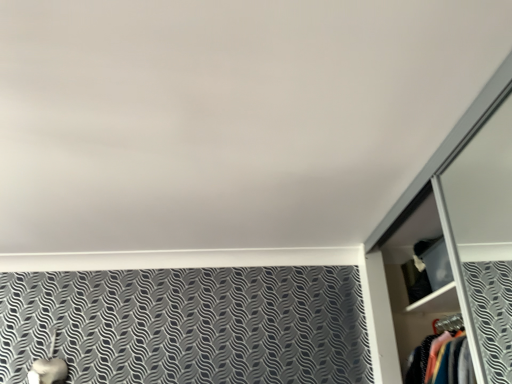
Question: Can you confirm if matte black cabinet at upper right is wider than metallic silver dresser at right?

Choices:
 (A) no
 (B) yes

Answer: (A)

Question: From the image's perspective, does matte black cabinet at upper right appear lower than metallic silver dresser at right?

Choices:
 (A) no
 (B) yes

Answer: (A)

Question: Can you confirm if matte black cabinet at upper right is taller than metallic silver dresser at right?

Choices:
 (A) yes
 (B) no

Answer: (B)

Question: Is matte black cabinet at upper right positioned far away from metallic silver dresser at right?

Choices:
 (A) no
 (B) yes

Answer: (A)

Question: Does matte black cabinet at upper right appear on the right side of metallic silver dresser at right?

Choices:
 (A) yes
 (B) no

Answer: (A)

Question: Is metallic silver dresser at right a part of matte black cabinet at upper right?

Choices:
 (A) yes
 (B) no

Answer: (B)

Question: Can you confirm if metallic silver dresser at right is wider than matte black cabinet at upper right?

Choices:
 (A) no
 (B) yes

Answer: (B)

Question: Considering the relative positions of metallic silver dresser at right and matte black cabinet at upper right in the image provided, is metallic silver dresser at right to the right of matte black cabinet at upper right from the viewer's perspective?

Choices:
 (A) no
 (B) yes

Answer: (A)

Question: Is metallic silver dresser at right oriented towards matte black cabinet at upper right?

Choices:
 (A) yes
 (B) no

Answer: (B)

Question: From a real-world perspective, does metallic silver dresser at right stand above matte black cabinet at upper right?

Choices:
 (A) yes
 (B) no

Answer: (B)

Question: Does metallic silver dresser at right have a lesser height compared to matte black cabinet at upper right?

Choices:
 (A) yes
 (B) no

Answer: (B)

Question: Is metallic silver dresser at right behind matte black cabinet at upper right?

Choices:
 (A) yes
 (B) no

Answer: (B)

Question: Is matte black cabinet at upper right wider or thinner than metallic silver dresser at right?

Choices:
 (A) thin
 (B) wide

Answer: (A)